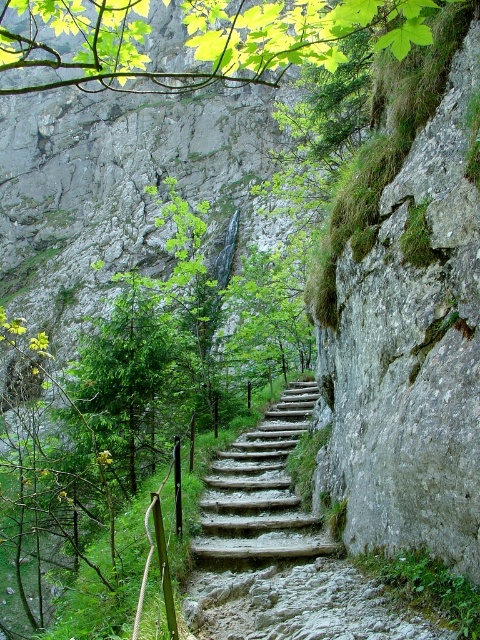
You are standing at the base of the stone staircase on the cliffside. You notice a point marked at coordinates (279,550). What object is located at that point?

The point at (279,550) is where the rustic wooden stairs at center are located.

You are a hiker standing at the base of the stone staircase and want to reach the top of the cliff. Which object, the rustic wooden stairs at center or the green leafy branch at upper center, will you encounter first as you climb?

You will encounter the rustic wooden stairs at center first because it is closer to you than the green leafy branch at upper center, which is further away.

From the picture: You are a hiker standing at the base of the stone staircase. You notice a green leafy branch at upper center. Can you estimate its position relative to the staircase using the given coordinates?

The green leafy branch at upper center is located at coordinates point (202, 38), which places it near the upper part of the staircase, slightly to the left side.